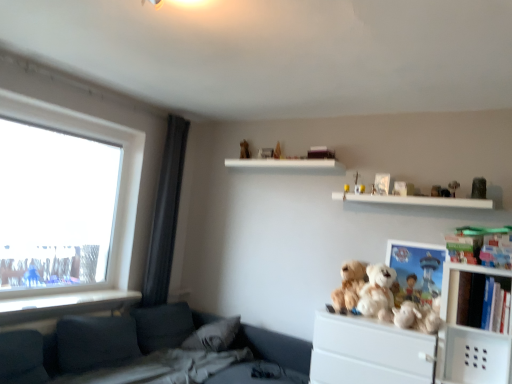
Question: Is fluffy white teddy bear at center-right, which is counted as the 4th toy, starting from the left, turned away from white plastic cabinet at right?

Choices:
 (A) yes
 (B) no

Answer: (B)

Question: Considering the relative positions of fluffy white teddy bear at center-right, which is counted as the 5th toy, starting from the right, and white plastic cabinet at right in the image provided, is fluffy white teddy bear at center-right, which is counted as the 5th toy, starting from the right, in front of white plastic cabinet at right?

Choices:
 (A) no
 (B) yes

Answer: (A)

Question: From the image's perspective, does fluffy white teddy bear at center-right, which is counted as the 4th toy, starting from the left, appear lower than white plastic cabinet at right?

Choices:
 (A) yes
 (B) no

Answer: (A)

Question: Can you confirm if fluffy white teddy bear at center-right, which is counted as the 5th toy, starting from the right, is shorter than white plastic cabinet at right?

Choices:
 (A) yes
 (B) no

Answer: (B)

Question: Could white plastic cabinet at right be considered to be inside fluffy white teddy bear at center-right, which is counted as the 4th toy, starting from the left?

Choices:
 (A) no
 (B) yes

Answer: (A)

Question: Considering the relative sizes of fluffy white teddy bear at center-right, which is counted as the 5th toy, starting from the right, and white plastic cabinet at right in the image provided, is fluffy white teddy bear at center-right, which is counted as the 5th toy, starting from the right, bigger than white plastic cabinet at right?

Choices:
 (A) no
 (B) yes

Answer: (A)

Question: From a real-world perspective, is white plush bear at upper right, positioned as the 7th toy in left-to-right order, located beneath yellow plush toy at upper center, arranged as the 2th toy when viewed from the left?

Choices:
 (A) no
 (B) yes

Answer: (A)

Question: Can we say white plush bear at upper right, acting as the 2th toy starting from the right, lies outside yellow plush toy at upper center, arranged as the 2th toy when viewed from the left?

Choices:
 (A) no
 (B) yes

Answer: (B)

Question: Does white plush bear at upper right, acting as the 2th toy starting from the right, have a greater width compared to yellow plush toy at upper center, arranged as the 2th toy when viewed from the left?

Choices:
 (A) yes
 (B) no

Answer: (A)

Question: Would you consider white plush bear at upper right, acting as the 2th toy starting from the right, to be distant from yellow plush toy at upper center, the seventh toy positioned from the right?

Choices:
 (A) no
 (B) yes

Answer: (A)

Question: Does white plush bear at upper right, positioned as the 7th toy in left-to-right order, contain yellow plush toy at upper center, the seventh toy positioned from the right?

Choices:
 (A) no
 (B) yes

Answer: (A)

Question: Can you see white plush bear at upper right, positioned as the 7th toy in left-to-right order, touching yellow plush toy at upper center, arranged as the 2th toy when viewed from the left?

Choices:
 (A) no
 (B) yes

Answer: (A)

Question: From a real-world perspective, is white plastic cabinet at right under white plush bear at upper center, acting as the third toy starting from the right?

Choices:
 (A) yes
 (B) no

Answer: (A)